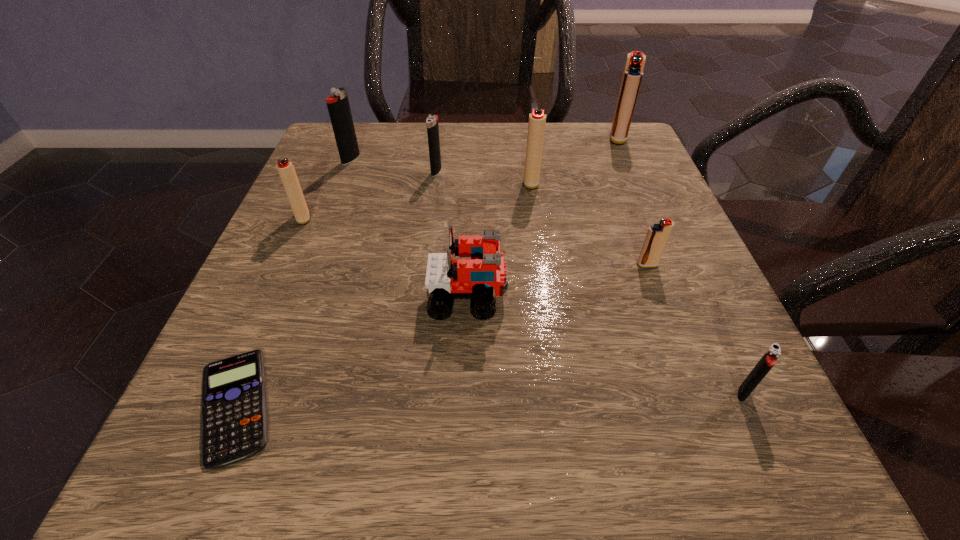
The width and height of the screenshot is (960, 540). I want to click on vacant area that lies between the second nearest igniter and the biggest red igniter, so click(633, 201).

The width and height of the screenshot is (960, 540). I want to click on blank region between the fifth farthest object and the sixth igniter from right to left, so click(x=327, y=188).

At what (x,y) coordinates should I click in order to perform the action: click on vacant space in between the second farthest red igniter and the shortest object. Please return your answer as a coordinate pair (x, y). This screenshot has height=540, width=960. Looking at the image, I should click on (383, 293).

Where is `unoccupied position between the nearest red igniter and the farthest red igniter`? Image resolution: width=960 pixels, height=540 pixels. unoccupied position between the nearest red igniter and the farthest red igniter is located at coordinates (633, 201).

This screenshot has height=540, width=960. What are the coordinates of `vacant area between the second biggest black igniter and the nearest red igniter` in the screenshot? It's located at (541, 218).

The image size is (960, 540). In order to click on empty space between the second smallest black igniter and the second biggest red igniter in this screenshot , I will do `click(484, 177)`.

Locate which object ranks seventh in proximity to the fifth nearest object. Please provide its 2D coordinates. Your answer should be formatted as a tuple, i.e. [(x, y)], where the tuple contains the x and y coordinates of a point satisfying the conditions above.

[(633, 72)]

The image size is (960, 540). I want to click on object that is the sixth closest to the fourth object from right to left, so click(x=286, y=170).

You are a GUI agent. You are given a task and a screenshot of the screen. Output one action in this format:
    pyautogui.click(x=<x>, y=<y>)
    Task: Click on the igniter that is the fifth nearest to the third nearest red igniter
    The width and height of the screenshot is (960, 540).
    Given the screenshot: What is the action you would take?
    pyautogui.click(x=286, y=170)

Where is `igniter object that ranks as the sixth closest to the third igniter from left to right`? Image resolution: width=960 pixels, height=540 pixels. igniter object that ranks as the sixth closest to the third igniter from left to right is located at coordinates (769, 359).